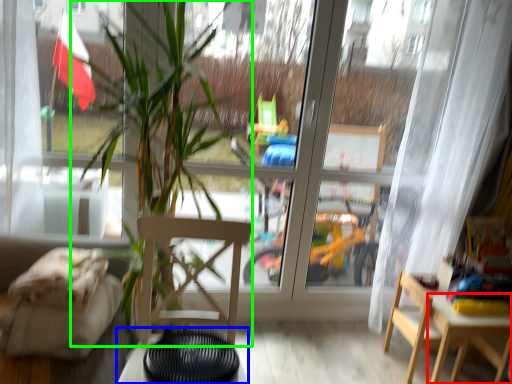
Question: Considering the real-world distances, which object is closest to table (highlighted by a red box)? table (highlighted by a blue box) or houseplant (highlighted by a green box).

Choices:
 (A) table
 (B) houseplant

Answer: (B)